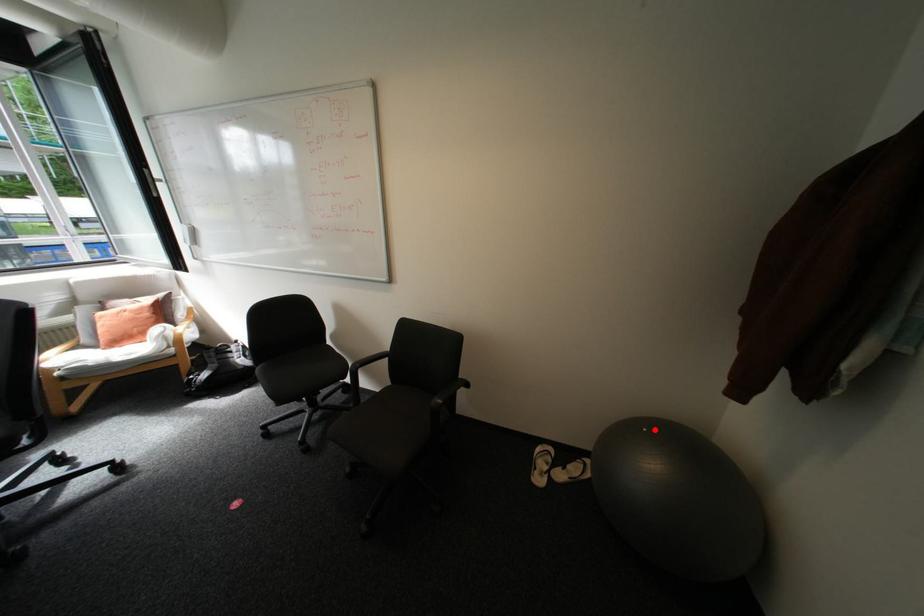
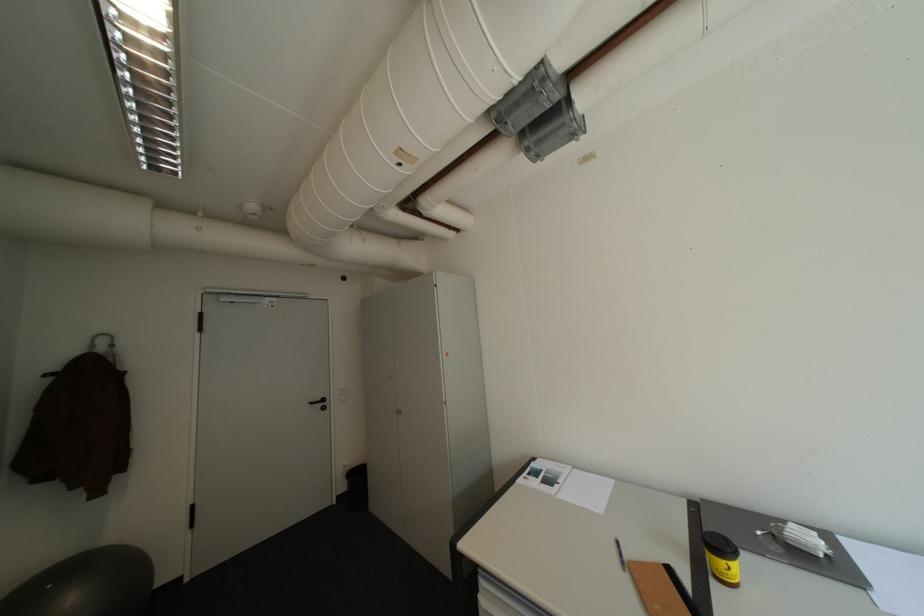
Where in the second image is the point corresponding to the highlighted location from the first image?

(59, 586)